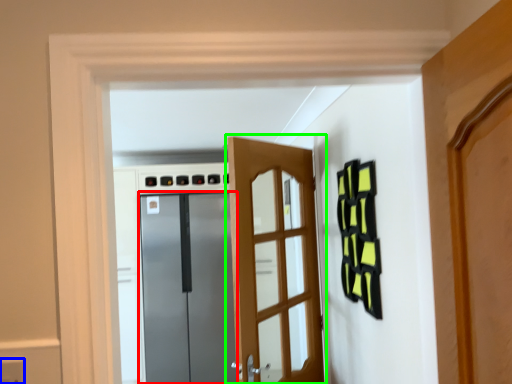
Question: Which object is positioned farthest from door (highlighted by a red box)? Select from electric outlet (highlighted by a blue box) and door (highlighted by a green box).

Choices:
 (A) electric outlet
 (B) door

Answer: (A)